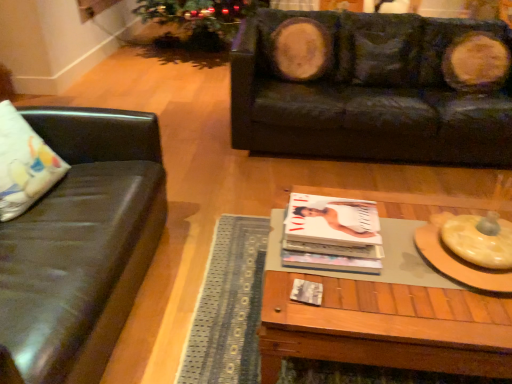
Identify the location of free space above matte white magazine at center (from a real-world perspective). The width and height of the screenshot is (512, 384). (332, 225).